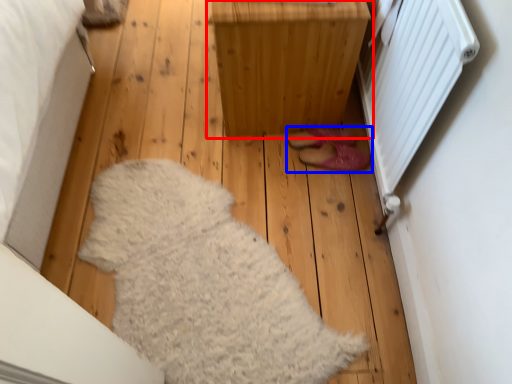
Question: Which object is further to the camera taking this photo, furniture (highlighted by a red box) or footwear (highlighted by a blue box)?

Choices:
 (A) furniture
 (B) footwear

Answer: (B)